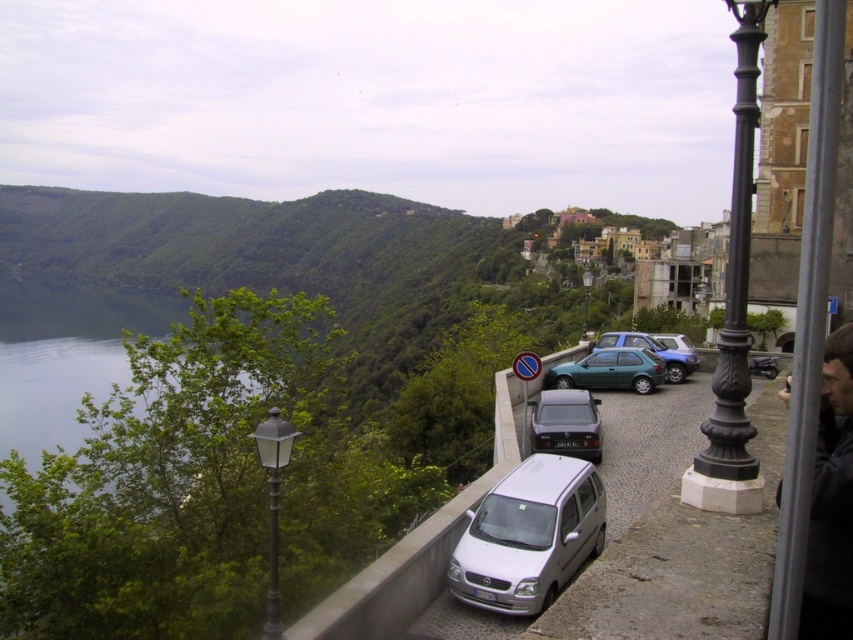
You are standing at the point marked by the coordinates point (653, 352). Looking around, you see the metallic blue hatchback at center and the no parking sign near the cars. Which object is closer to your current position?

The point (653, 352) indicates the metallic blue hatchback at center, so you are standing right at the metallic blue hatchback at center. Therefore, the metallic blue hatchback at center is at your current position, making it the closest object.

You are standing at the edge of the paved area near the parked cars and want to walk towards the valley. Which point, point (628, 385) or point (585, 282), would you reach first?

Point (628, 385) is closer to the viewer than point (585, 282), so you would reach point (628, 385) first.